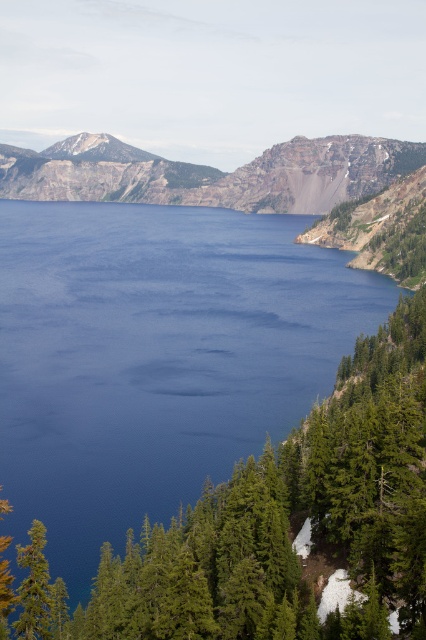
Which is more to the left, deep blue water at center or rugged brown rock at center?

rugged brown rock at center is more to the left.

Is point (305, 323) closer to camera compared to point (221, 188)?

Yes, it is.

Does point (78, 330) come closer to viewer compared to point (57, 180)?

Yes, it is.

This screenshot has width=426, height=640. I want to click on deep blue water at center, so click(155, 356).